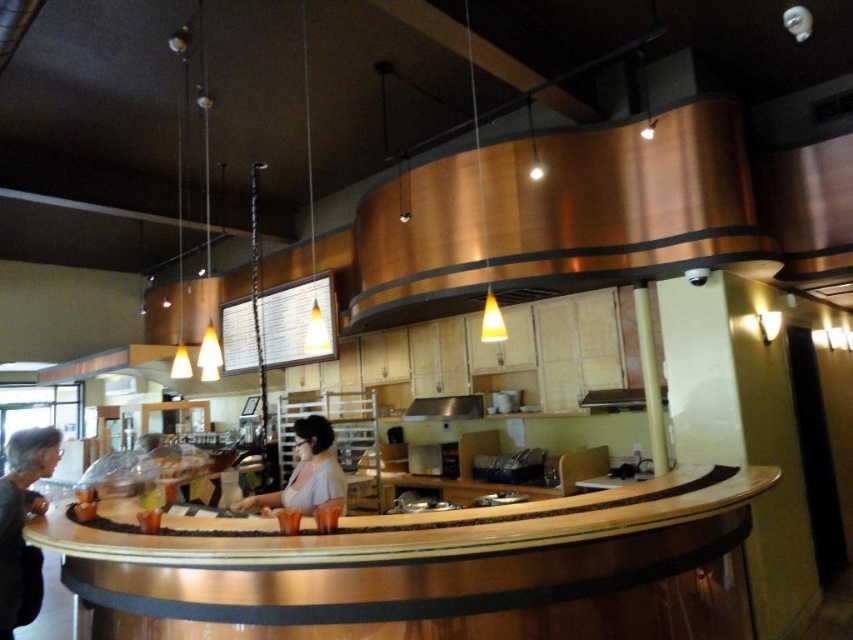
You are a GUI agent. You are given a task and a screenshot of the screen. Output one action in this format:
    pyautogui.click(x=<x>, y=<y>)
    Task: Click on the wooden counter at center
    This screenshot has height=640, width=853.
    Given the screenshot: What is the action you would take?
    coord(430,570)

Can you confirm if wooden counter at center is wider than light beige fabric shirt at center?

Yes.

This screenshot has width=853, height=640. What do you see at coordinates (430, 570) in the screenshot?
I see `wooden counter at center` at bounding box center [430, 570].

I want to click on wooden counter at center, so click(430, 570).